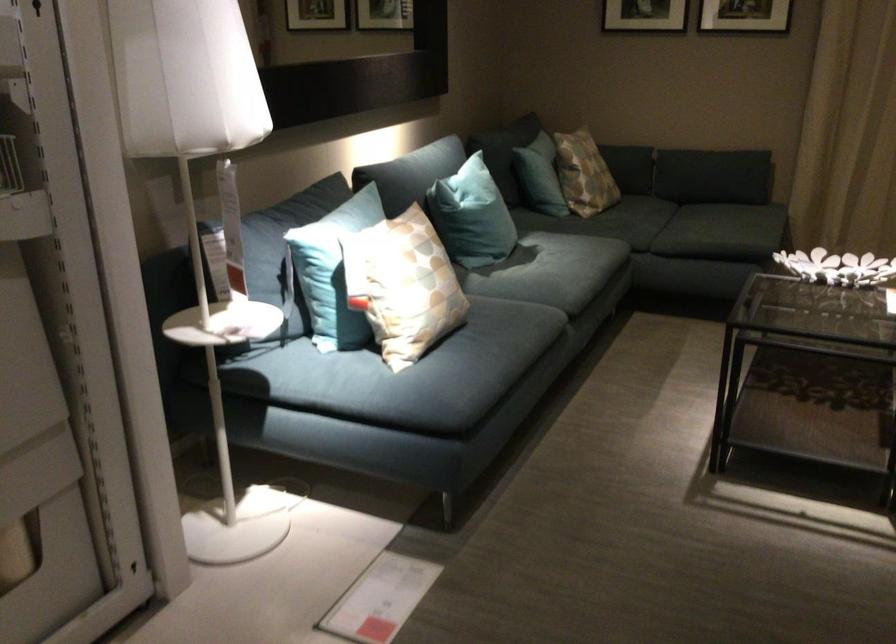
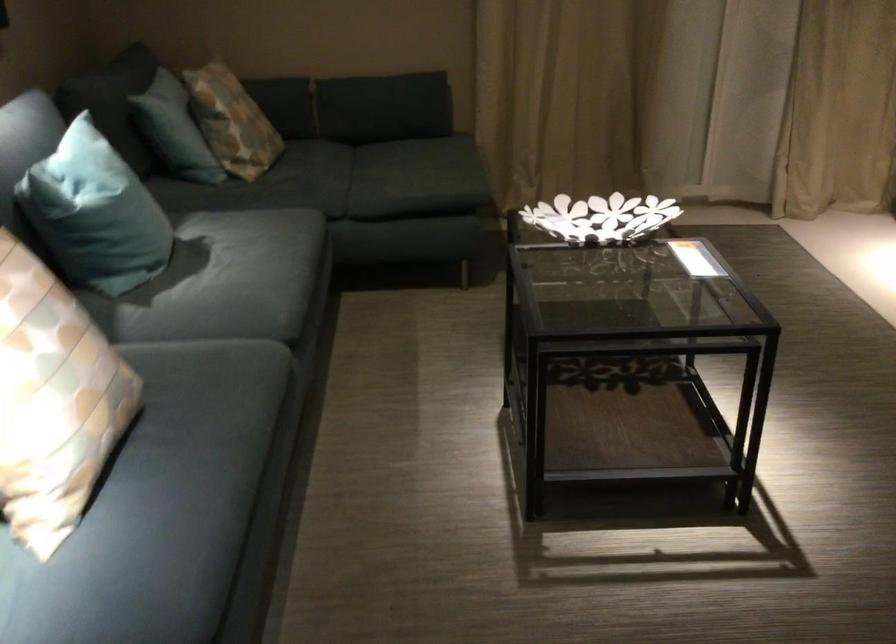
Find the pixel in the second image that matches (x=408, y=292) in the first image.

(53, 401)